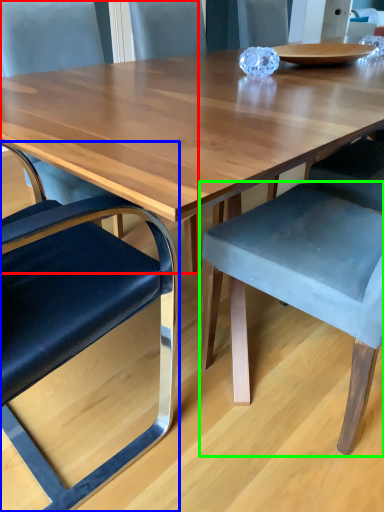
Question: Which is nearer to the chair (highlighted by a red box)? chair (highlighted by a blue box) or chair (highlighted by a green box).

Choices:
 (A) chair
 (B) chair

Answer: (A)